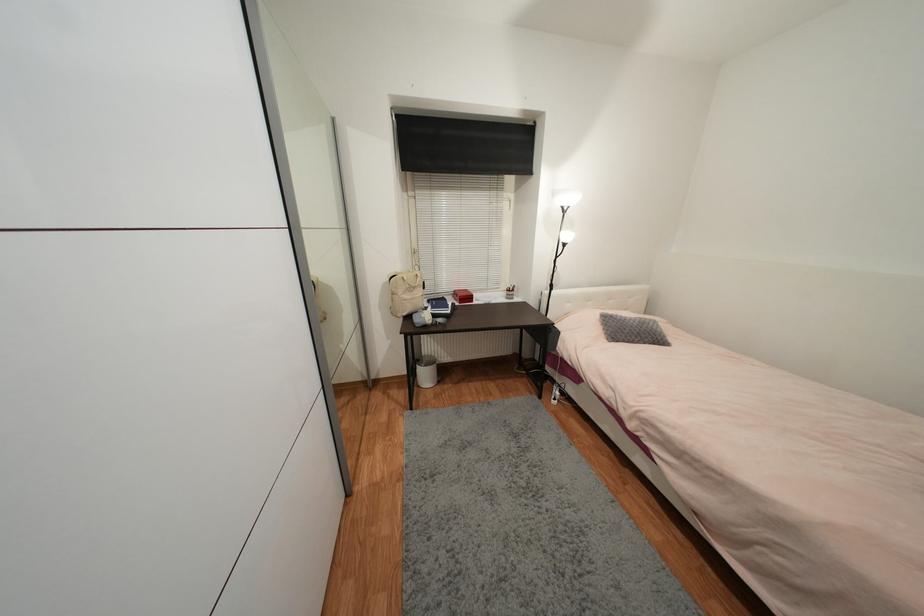
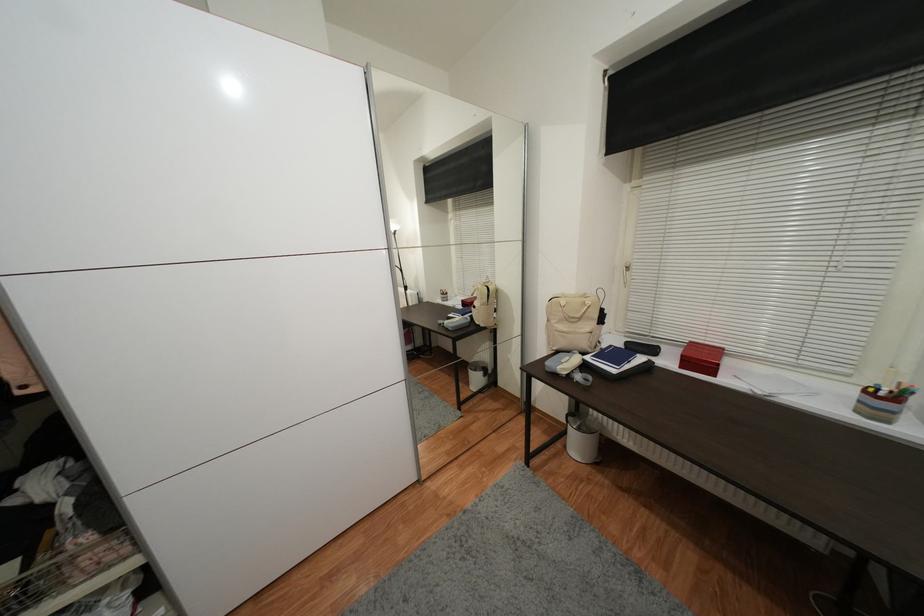
Locate, in the second image, the point that corresponds to point (435, 190) in the first image.

(678, 167)